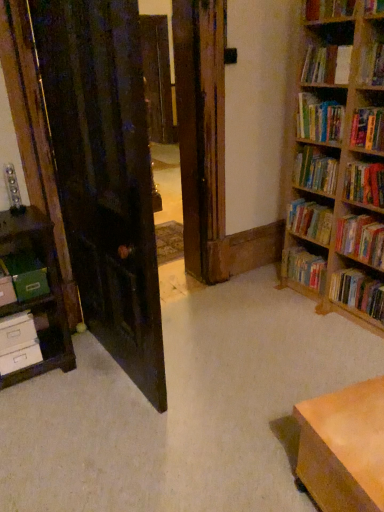
This screenshot has height=512, width=384. What are the coordinates of `vacant space underneath dark wood door at left (from a real-world perspective)` in the screenshot? It's located at (114, 372).